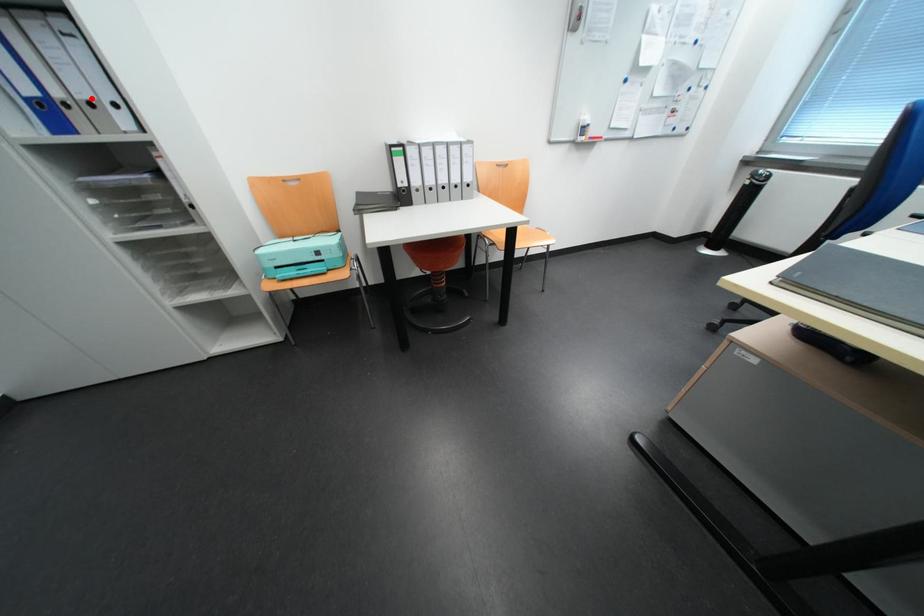
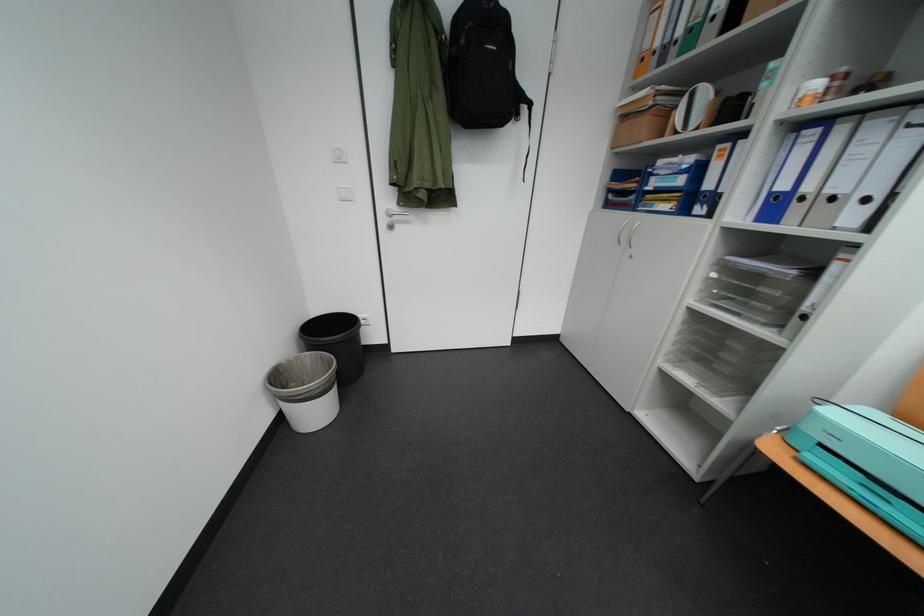
Question: A red point is marked in image1. In image2, is the corresponding 3D point closer to the camera or farther? Reply with the corresponding letter.

Choices:
 (A) The corresponding 3D point is closer.
 (B) The corresponding 3D point is farther.

Answer: (A)